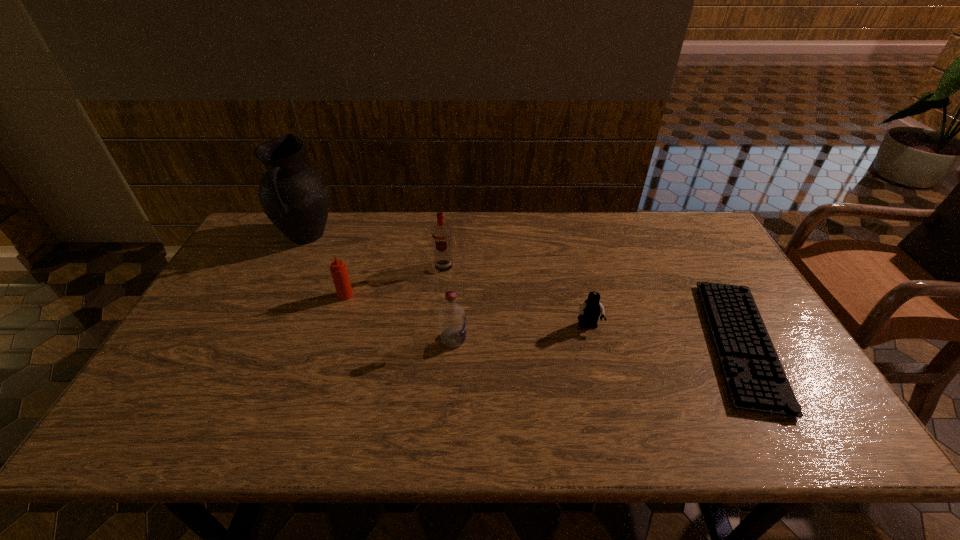
I want to click on vacant space located 0.090m on the side of the pitcher with the handle, so click(x=287, y=276).

The width and height of the screenshot is (960, 540). I want to click on free spot located 0.360m on the front label of the farther vodka, so click(434, 368).

This screenshot has height=540, width=960. Find the location of `vacant area situated 0.190m on the label of the shorter vodka`. vacant area situated 0.190m on the label of the shorter vodka is located at coordinates click(x=539, y=339).

Where is `free point located 0.300m on the right of the Tabasco sauce`? free point located 0.300m on the right of the Tabasco sauce is located at coordinates (456, 295).

This screenshot has height=540, width=960. I want to click on free space located 0.170m on the front-facing side of the Lego, so click(603, 387).

Where is `free region located on the back of the rightmost object`? This screenshot has width=960, height=540. free region located on the back of the rightmost object is located at coordinates (678, 232).

Identify the location of object located at the far edge. This screenshot has height=540, width=960. (294, 196).

I want to click on object located at the near edge, so click(756, 381).

Locate an element on the screen. This screenshot has width=960, height=540. object that is at the left edge is located at coordinates (294, 196).

This screenshot has width=960, height=540. I want to click on object at the right edge, so click(756, 381).